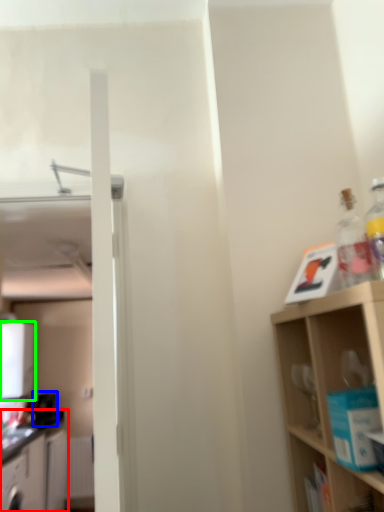
Question: Considering the real-world distances, which object is farthest from cabinetry (highlighted by a red box)? appliance (highlighted by a blue box) or appliance (highlighted by a green box)?

Choices:
 (A) appliance
 (B) appliance

Answer: (B)